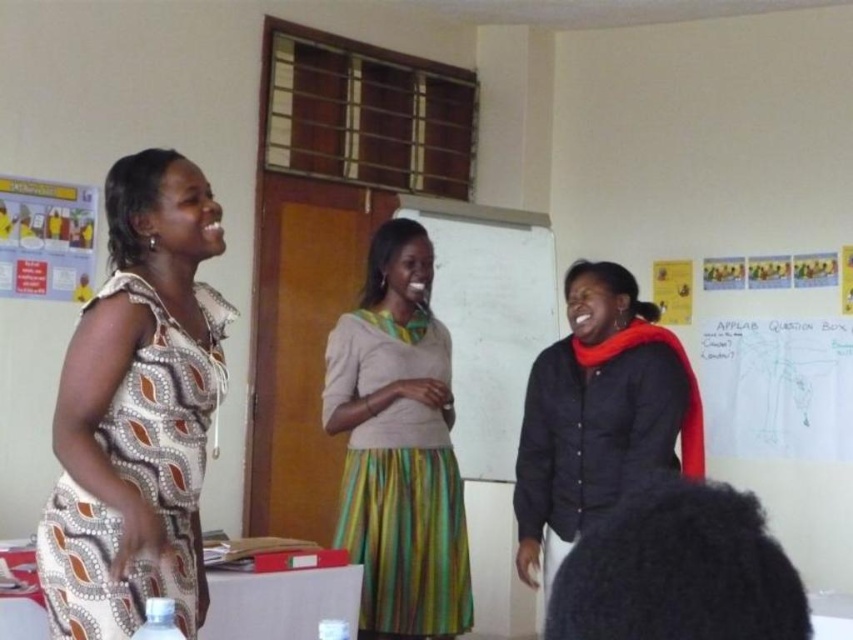
You are a photographer setting up for a group photo in this classroom. You need to ensure that the printed fabric dress at left and the whiteboard at center are both visible in the frame. Based on their sizes, which object should you focus on first to ensure proper framing?

The printed fabric dress at left is not as tall as the whiteboard at center, so you should focus on framing the whiteboard at center first to accommodate its larger size.

You are an interior designer assessing the layout of this room. You notice the printed fabric dress at left and the green striped skirt at center. Based on their positions, which one is higher up in the image?

The printed fabric dress at left is located above the green striped skirt at center, so it is higher up in the image.